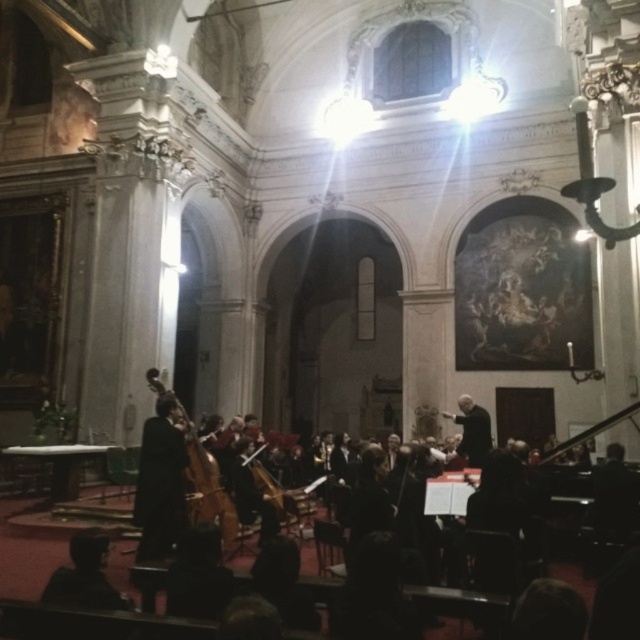
Can you confirm if black velvet suit at center is smaller than dark brown hair at lower left?

Incorrect, black velvet suit at center is not smaller in size than dark brown hair at lower left.

Who is more forward, [168,490] or [97,605]?

Positioned in front is point [97,605].

I want to click on black velvet suit at center, so click(x=161, y=483).

Locate an element on the screen. black velvet suit at center is located at coordinates (161, 483).

Does point (96, 593) come farther from viewer compared to point (484, 419)?

That is False.

Between dark brown hair at lower left and black matte conductor at center, which one appears on the right side from the viewer's perspective?

From the viewer's perspective, black matte conductor at center appears more on the right side.

What do you see at coordinates (84, 576) in the screenshot? I see `dark brown hair at lower left` at bounding box center [84, 576].

The height and width of the screenshot is (640, 640). In order to click on dark brown hair at lower left in this screenshot , I will do `click(84, 576)`.

Between black velvet suit at center and wooden polished cello at center, which one is positioned lower?

black velvet suit at center is lower down.

What do you see at coordinates (161, 483) in the screenshot?
I see `black velvet suit at center` at bounding box center [161, 483].

Which is in front, point (176, 477) or point (227, 509)?

Point (176, 477)

This screenshot has height=640, width=640. I want to click on black velvet suit at center, so click(x=161, y=483).